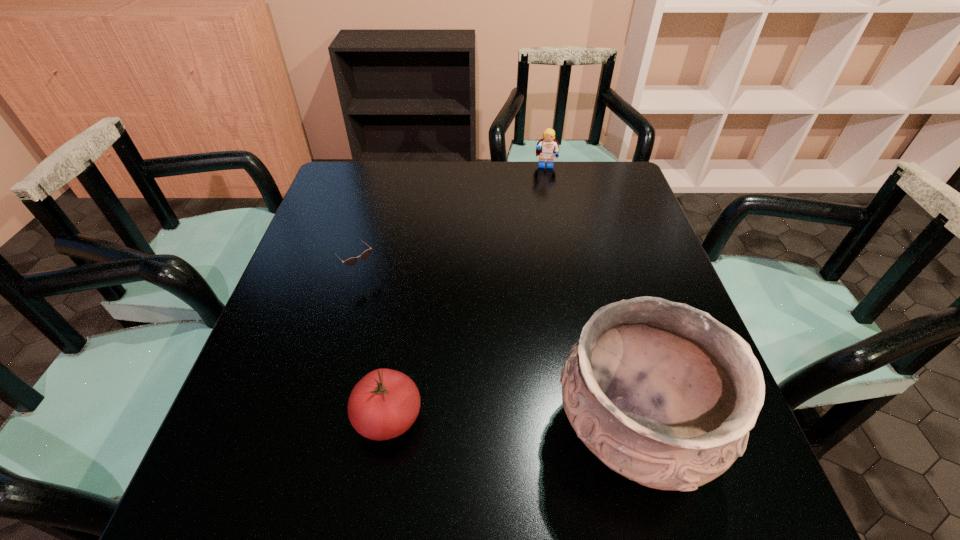
The width and height of the screenshot is (960, 540). In the image, there is a desktop. Identify the location of vacant region at the near edge. (353, 436).

Image resolution: width=960 pixels, height=540 pixels. In order to click on free space at the left edge in this screenshot , I will do `click(330, 272)`.

In order to click on vacant space at the right edge of the desktop in this screenshot , I will do 631,231.

Where is `vacant space at the far left corner of the desktop`? vacant space at the far left corner of the desktop is located at coordinates (371, 205).

Identify the location of vacant space that is in between the second farthest object and the pottery. (498, 353).

Identify the location of free space between the third nearest object and the tomato. The width and height of the screenshot is (960, 540). (376, 346).

Identify the location of free space between the shortest object and the farthest object. (454, 220).

You are a GUI agent. You are given a task and a screenshot of the screen. Output one action in this format:
    pyautogui.click(x=<x>, y=<y>)
    Task: Click on the vacant area between the tomato and the pottery
    The image size is (960, 540).
    Given the screenshot: What is the action you would take?
    (511, 424)

Locate an element on the screen. Image resolution: width=960 pixels, height=540 pixels. empty space that is in between the farthest object and the pottery is located at coordinates (588, 299).

This screenshot has width=960, height=540. What are the coordinates of `free space between the tomato and the sunglasses` in the screenshot? It's located at (376, 346).